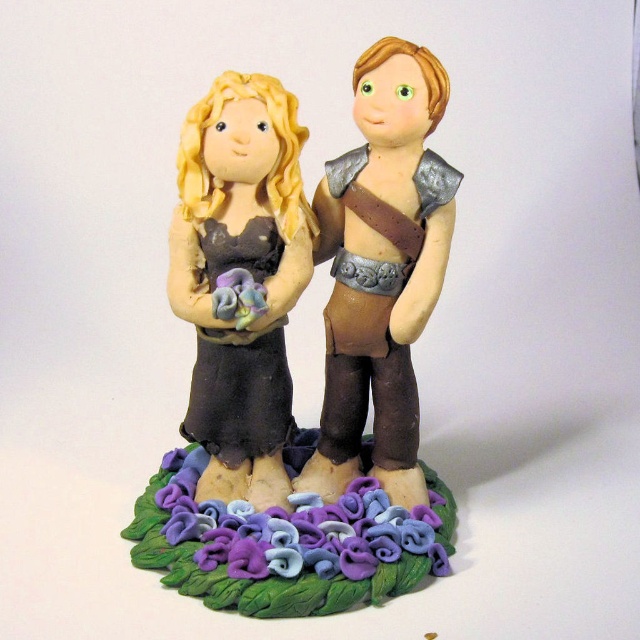
You are an artist trying to place a small decorative plaque between the brown leather armor at center and the purple clay flowers at center. The plaque is 10 cm tall. Can the plaque fit vertically between them?

The brown leather armor at center is taller than purple clay flowers at center. Since the plaque is only 10 cm tall, it can fit vertically between them as long as the height difference between the two objects allows for the plaque to be placed without exceeding either object.